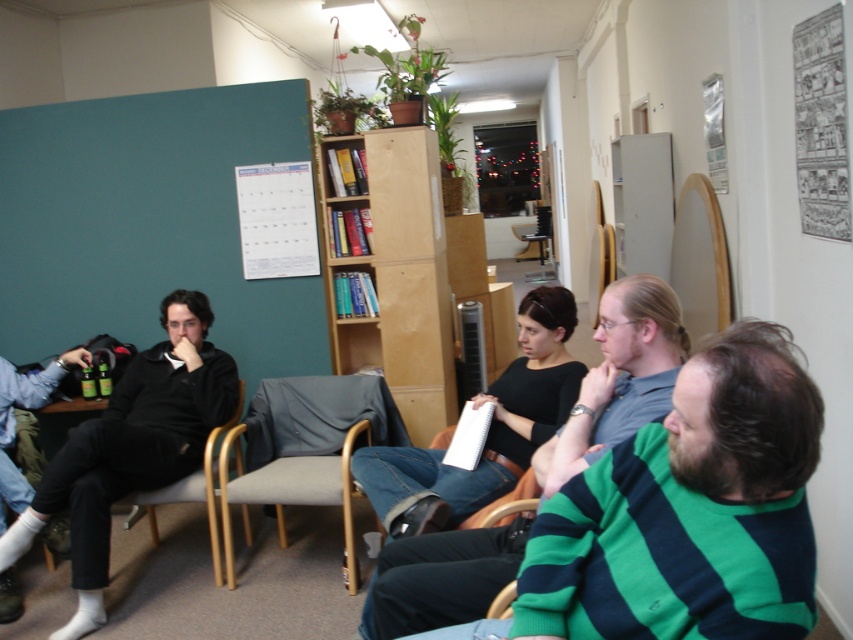
You are an office worker who needs to sit down. You see the gray fabric armchair at center and the matte black pants at left. Which object is closer to the floor?

The gray fabric armchair at center is closer to the floor because it is located below the matte black pants at left.

In the scene, there is a gray fabric armchair at center and a matte black pants at left. From the perspective of someone standing in the room, which object is positioned to the right side?

The gray fabric armchair at center is positioned to the right of the matte black pants at left.

You are a delivery person who needs to place a package between the bare wood bookshelf at center and the matte black pants at left. Can you fit the package if it requires 5 feet of space?

The bare wood bookshelf at center and matte black pants at left are 4.75 feet apart, so the package requiring 5 feet of space cannot fit between them.